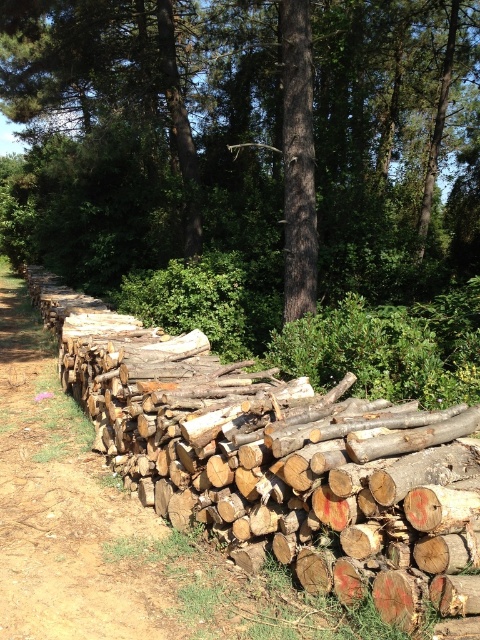
Question: Which object is closer to the camera taking this photo?

Choices:
 (A) brown rough tree trunk at center
 (B) brown dirt track at lower left

Answer: (B)

Question: Which object appears closest to the camera in this image?

Choices:
 (A) natural wood logs at left
 (B) brown rough tree trunk at center

Answer: (A)

Question: Can you confirm if brown wood log at center is positioned to the right of brown rough tree trunk at center?

Choices:
 (A) no
 (B) yes

Answer: (A)

Question: Can you confirm if natural wood logs at left is bigger than brown dirt track at lower left?

Choices:
 (A) no
 (B) yes

Answer: (B)

Question: Which object is the closest to the brown wood log at center?

Choices:
 (A) natural wood logs at left
 (B) brown rough tree trunk at center

Answer: (A)

Question: Does natural wood logs at left lie in front of brown rough tree trunk at center?

Choices:
 (A) no
 (B) yes

Answer: (B)